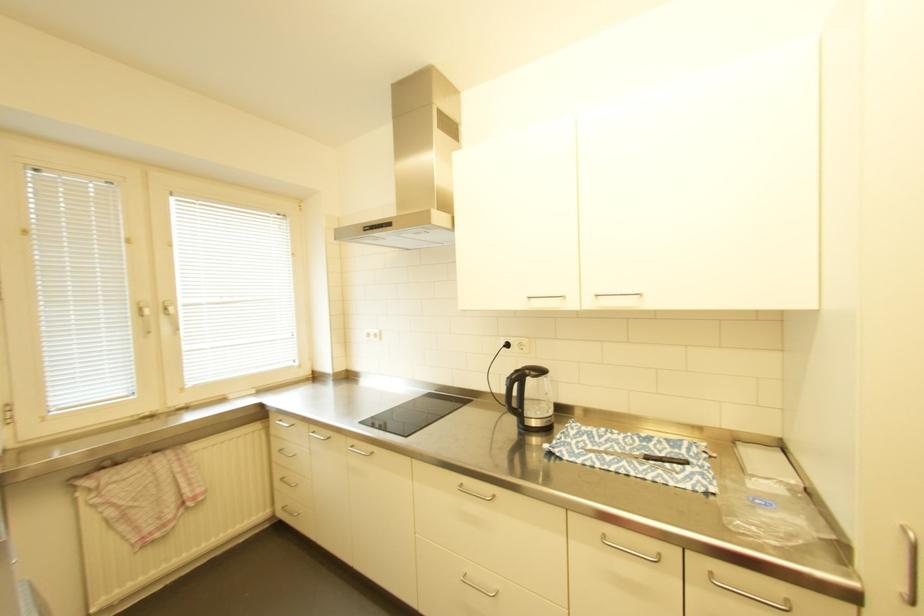
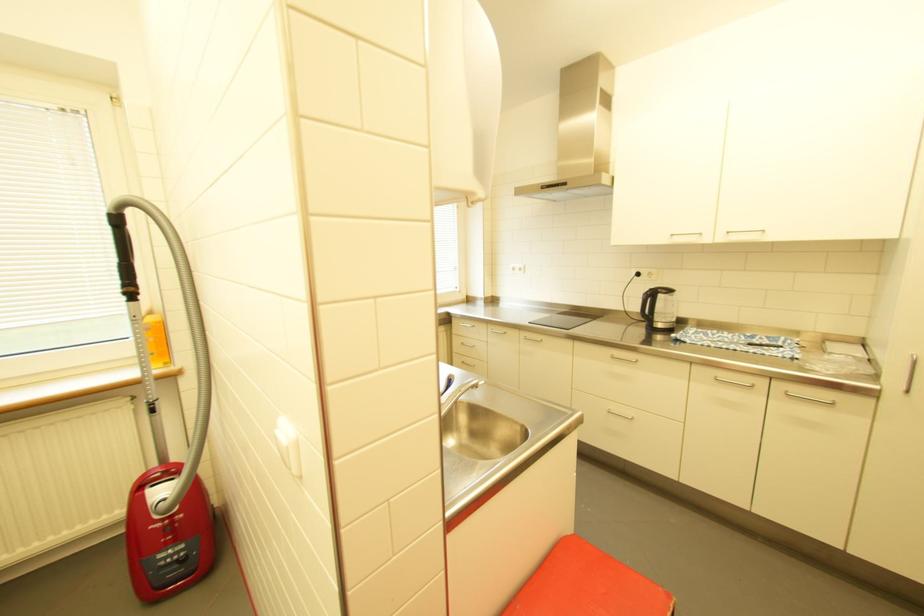
Locate, in the second image, the point that corresponds to (528,305) in the first image.

(671, 241)